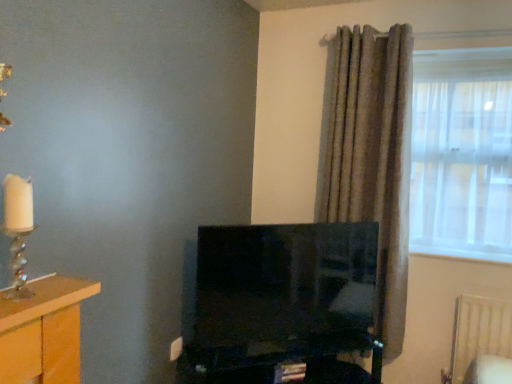
Question: Is black glossy computer desk at center looking in the opposite direction of textured gray curtain at right?

Choices:
 (A) yes
 (B) no

Answer: (B)

Question: Can textured gray curtain at right be found inside black glossy computer desk at center?

Choices:
 (A) yes
 (B) no

Answer: (B)

Question: Considering the relative positions of black glossy computer desk at center and textured gray curtain at right in the image provided, is black glossy computer desk at center to the right of textured gray curtain at right from the viewer's perspective?

Choices:
 (A) no
 (B) yes

Answer: (A)

Question: From the image's perspective, is black glossy computer desk at center over textured gray curtain at right?

Choices:
 (A) no
 (B) yes

Answer: (A)

Question: Can you confirm if black glossy computer desk at center is taller than textured gray curtain at right?

Choices:
 (A) yes
 (B) no

Answer: (B)

Question: Looking at their shapes, would you say translucent glass candle holder at left is wider or thinner than translucent fabric window at right?

Choices:
 (A) thin
 (B) wide

Answer: (A)

Question: Considering the positions of translucent glass candle holder at left and translucent fabric window at right in the image, is translucent glass candle holder at left taller or shorter than translucent fabric window at right?

Choices:
 (A) short
 (B) tall

Answer: (A)

Question: Is translucent glass candle holder at left in front of or behind translucent fabric window at right in the image?

Choices:
 (A) behind
 (B) front

Answer: (B)

Question: Would you say translucent glass candle holder at left is to the left or to the right of translucent fabric window at right in the picture?

Choices:
 (A) right
 (B) left

Answer: (B)

Question: Based on their sizes in the image, would you say translucent glass candle holder at left is bigger or smaller than textured gray curtain at right?

Choices:
 (A) small
 (B) big

Answer: (A)

Question: Is translucent glass candle holder at left wider or thinner than textured gray curtain at right?

Choices:
 (A) thin
 (B) wide

Answer: (A)

Question: Is point (24, 243) positioned closer to the camera than point (387, 233)?

Choices:
 (A) closer
 (B) farther

Answer: (A)

Question: Relative to textured gray curtain at right, is translucent glass candle holder at left in front or behind?

Choices:
 (A) behind
 (B) front

Answer: (B)

Question: Is textured gray curtain at right bigger or smaller than wooden table at left?

Choices:
 (A) big
 (B) small

Answer: (A)

Question: Does point (400, 347) appear closer or farther from the camera than point (19, 374)?

Choices:
 (A) closer
 (B) farther

Answer: (B)